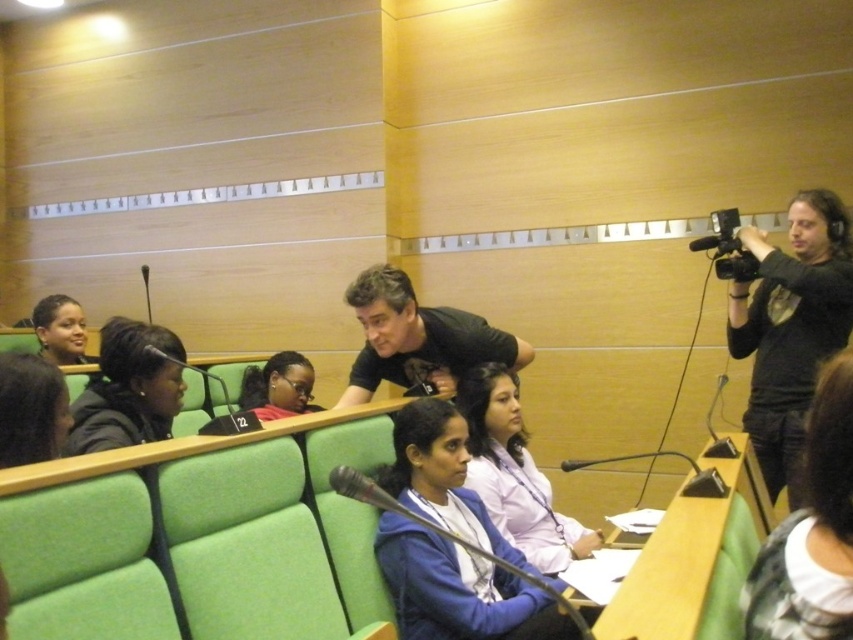
Can you confirm if black matte shirt at center is taller than black plastic video camera at upper right?

Correct, black matte shirt at center is much taller as black plastic video camera at upper right.

Which is behind, point (465, 336) or point (746, 275)?

The point (746, 275) is more distant.

The width and height of the screenshot is (853, 640). Identify the location of black matte shirt at center. (416, 339).

Which is behind, point (390, 588) or point (743, 273)?

Point (743, 273)

Can you confirm if blue fabric jacket at center is bigger than black plastic video camera at upper right?

Yes.

Is point (509, 632) farther from viewer compared to point (715, 246)?

No, (509, 632) is closer to viewer.

You are a GUI agent. You are given a task and a screenshot of the screen. Output one action in this format:
    pyautogui.click(x=<x>, y=<y>)
    Task: Click on the blue fabric jacket at center
    Image resolution: width=853 pixels, height=640 pixels.
    Given the screenshot: What is the action you would take?
    pyautogui.click(x=457, y=589)

Between light purple shirt at center and black plastic video camera at upper right, which one is positioned lower?

Positioned lower is light purple shirt at center.

Where is `light purple shirt at center`? The height and width of the screenshot is (640, 853). light purple shirt at center is located at coordinates (515, 474).

I want to click on light purple shirt at center, so click(515, 474).